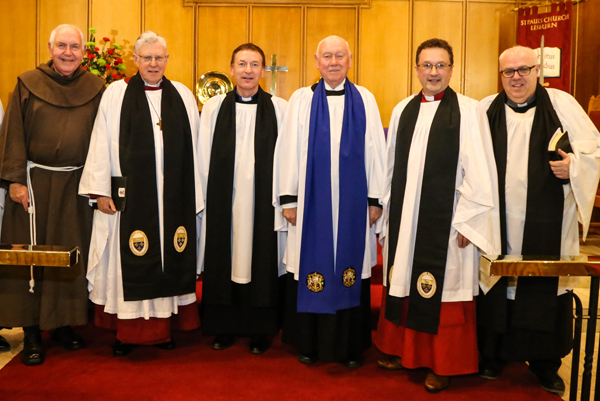
Find the location of a particular element. red carpet is located at coordinates (x=249, y=382).